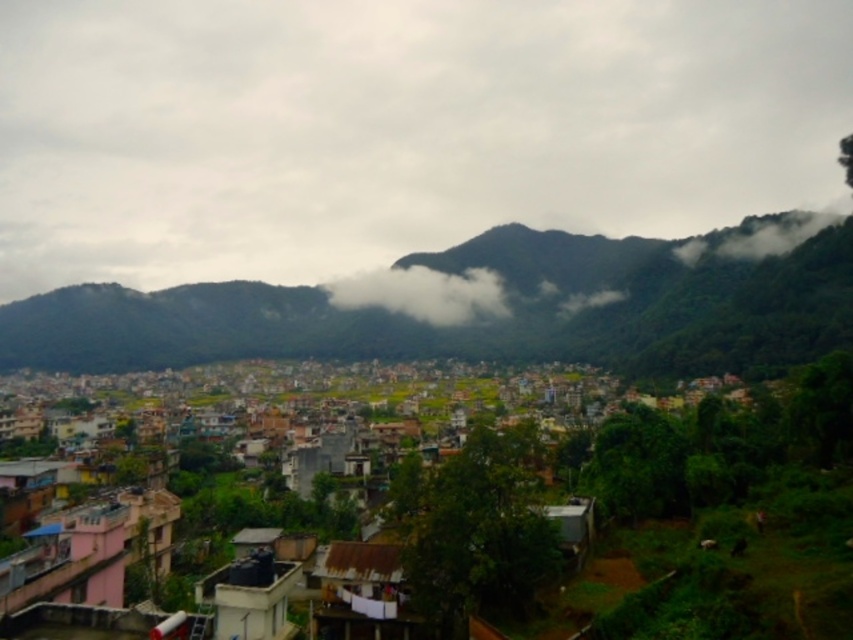
Question: Which point appears farthest from the camera in this image?

Choices:
 (A) (759, 289)
 (B) (386, 442)

Answer: (A)

Question: Where is white fluffy cloud at center located in relation to green leafy cloud at upper right in the image?

Choices:
 (A) left
 (B) right

Answer: (A)

Question: Does green forested mountain at center appear under white fluffy cloud at center?

Choices:
 (A) yes
 (B) no

Answer: (A)

Question: Which of the following is the farthest from the observer?

Choices:
 (A) green leafy cloud at upper right
 (B) white fluffy cloud at center
 (C) multicolored buildings at center

Answer: (B)

Question: Which point is farther from the camera taking this photo?

Choices:
 (A) (265, 486)
 (B) (746, 234)
 (C) (538, 278)

Answer: (C)

Question: Can you confirm if white fluffy cloud at center is smaller than green leafy cloud at upper right?

Choices:
 (A) yes
 (B) no

Answer: (B)